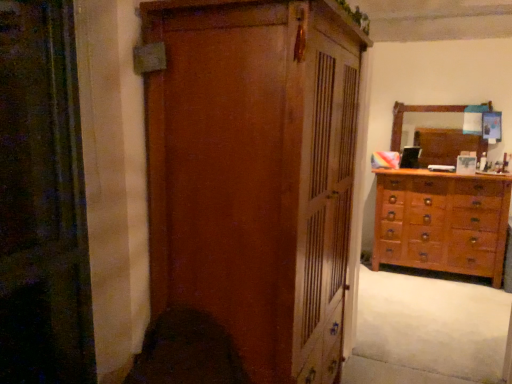
Question: Is wooden wardrobe at center positioned beyond the bounds of wooden mirror at upper right?

Choices:
 (A) yes
 (B) no

Answer: (A)

Question: Is wooden wardrobe at center beside wooden mirror at upper right?

Choices:
 (A) yes
 (B) no

Answer: (B)

Question: Considering the relative sizes of wooden wardrobe at center and wooden mirror at upper right in the image provided, is wooden wardrobe at center taller than wooden mirror at upper right?

Choices:
 (A) no
 (B) yes

Answer: (B)

Question: Does wooden wardrobe at center appear on the right side of wooden mirror at upper right?

Choices:
 (A) yes
 (B) no

Answer: (B)

Question: Considering the relative sizes of wooden wardrobe at center and wooden mirror at upper right in the image provided, is wooden wardrobe at center shorter than wooden mirror at upper right?

Choices:
 (A) yes
 (B) no

Answer: (B)

Question: Is wooden wardrobe at center to the left or to the right of white soft carpet at lower right in the image?

Choices:
 (A) right
 (B) left

Answer: (B)

Question: Considering the positions of wooden wardrobe at center and white soft carpet at lower right in the image, is wooden wardrobe at center bigger or smaller than white soft carpet at lower right?

Choices:
 (A) big
 (B) small

Answer: (A)

Question: Is wooden wardrobe at center wider or thinner than white soft carpet at lower right?

Choices:
 (A) wide
 (B) thin

Answer: (B)

Question: From their relative heights in the image, would you say wooden wardrobe at center is taller or shorter than white soft carpet at lower right?

Choices:
 (A) short
 (B) tall

Answer: (B)

Question: In terms of width, does wooden wardrobe at center look wider or thinner when compared to wooden dresser at right?

Choices:
 (A) wide
 (B) thin

Answer: (A)

Question: Is wooden wardrobe at center to the left or to the right of wooden dresser at right in the image?

Choices:
 (A) left
 (B) right

Answer: (A)

Question: Which is correct: wooden wardrobe at center is inside wooden dresser at right, or outside of it?

Choices:
 (A) outside
 (B) inside

Answer: (A)

Question: Is wooden wardrobe at center bigger or smaller than wooden dresser at right?

Choices:
 (A) big
 (B) small

Answer: (A)

Question: Relative to wooden wardrobe at center, is wooden dresser at right in front or behind?

Choices:
 (A) front
 (B) behind

Answer: (B)

Question: From a real-world perspective, is wooden dresser at right above or below wooden wardrobe at center?

Choices:
 (A) above
 (B) below

Answer: (B)